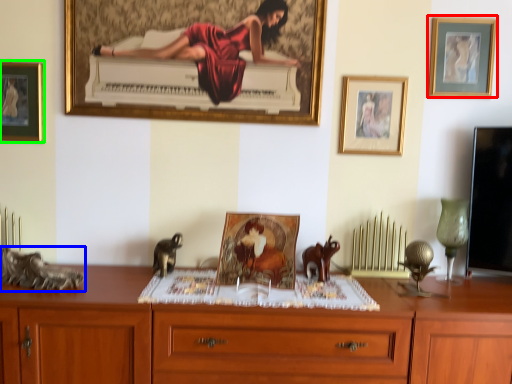
Question: Which is farther away from picture frame (highlighted by a red box)? animal (highlighted by a blue box) or picture frame (highlighted by a green box)?

Choices:
 (A) animal
 (B) picture frame

Answer: (A)